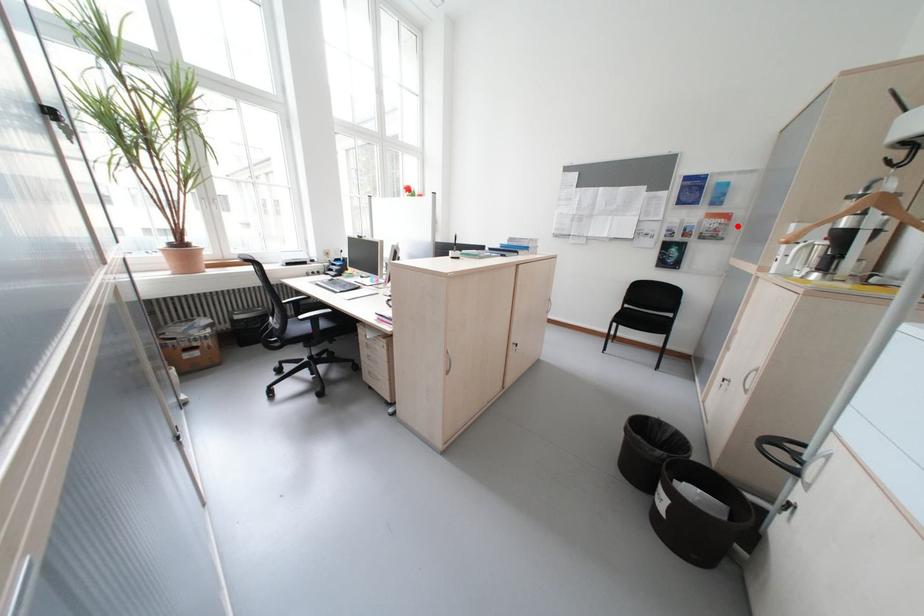
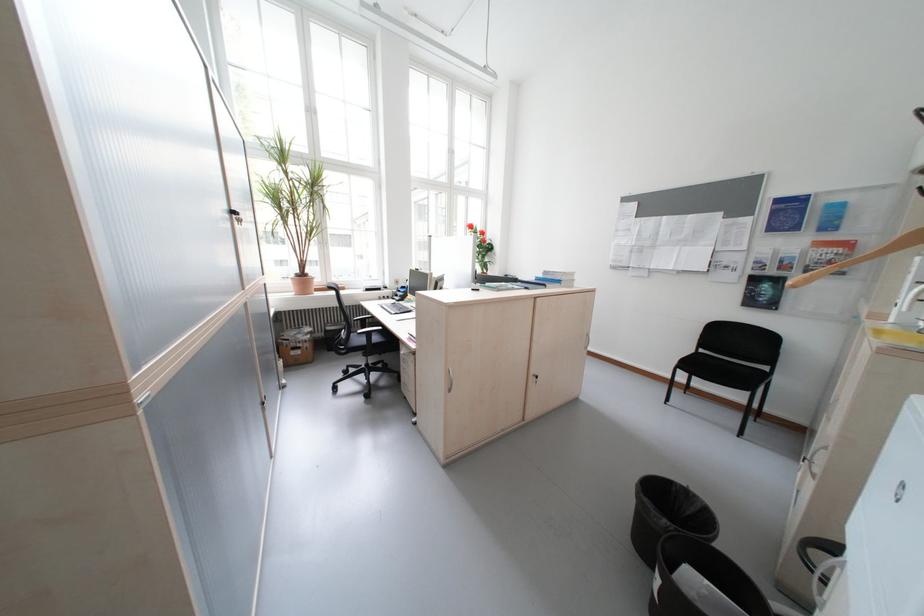
In the second image, find the point that corresponds to the highlighted location in the first image.

(859, 257)